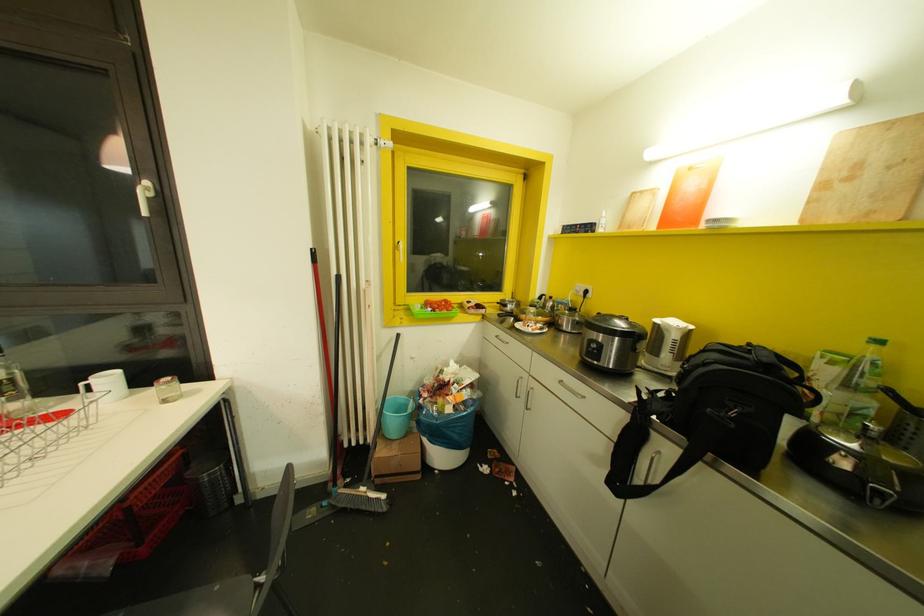
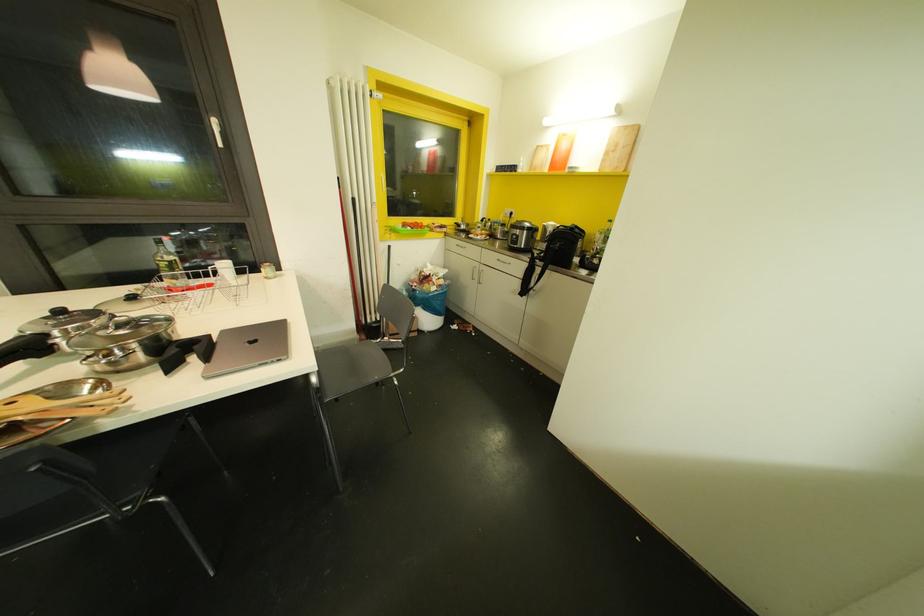
Where in the second image is the point corresponding to the point at 397,334 from the first image?

(388, 246)